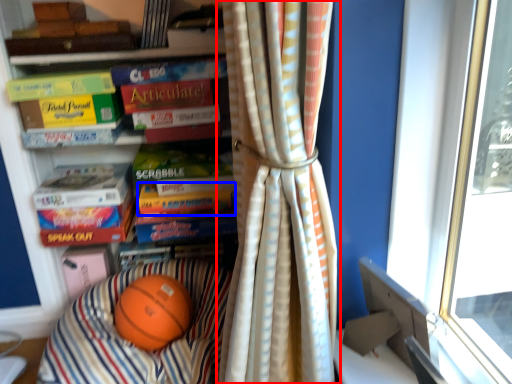
Question: Which of the following is the closest to the observer, curtain (highlighted by a red box) or paperback book (highlighted by a blue box)?

Choices:
 (A) curtain
 (B) paperback book

Answer: (A)